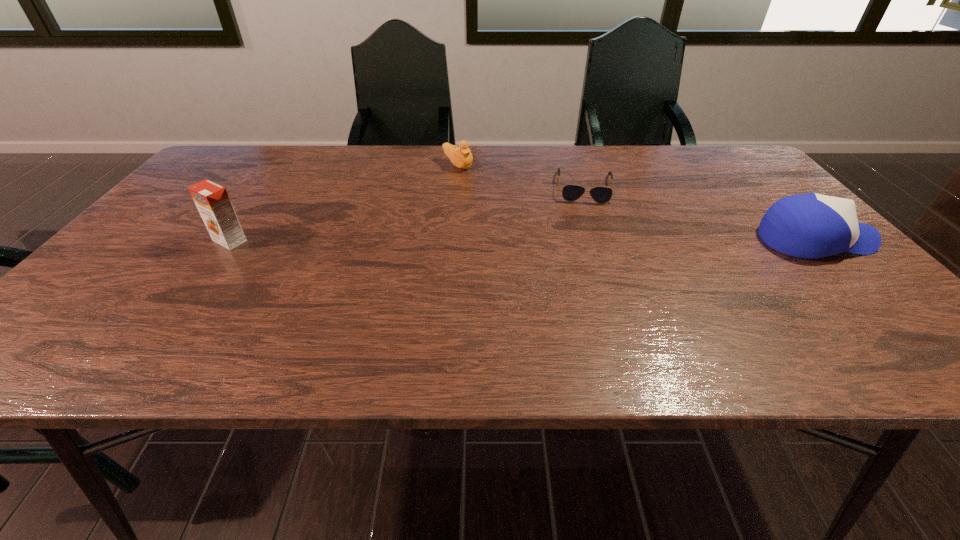
Identify the location of vacant space on the desktop that is between the tallest object and the second tallest object and is positioned on the face of the duckling. (x=599, y=240).

Where is `vacant spot on the desktop that is between the orange juice and the baseball cap and is positioned on the front-facing side of the second object from right to left`? Image resolution: width=960 pixels, height=540 pixels. vacant spot on the desktop that is between the orange juice and the baseball cap and is positioned on the front-facing side of the second object from right to left is located at coordinates (588, 240).